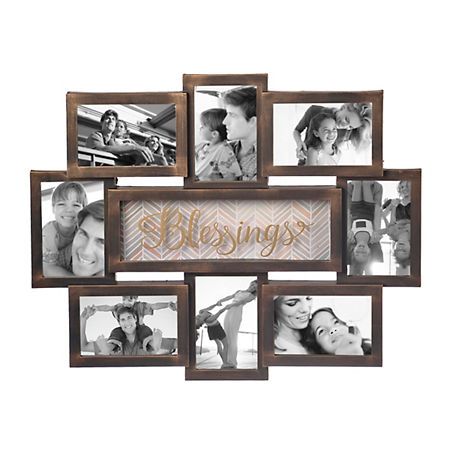
The image size is (450, 450). I want to click on left side of frames, so click(34, 220), click(70, 135), click(191, 136), click(266, 130), click(111, 220), click(74, 322), click(191, 279), click(264, 323), click(339, 184).